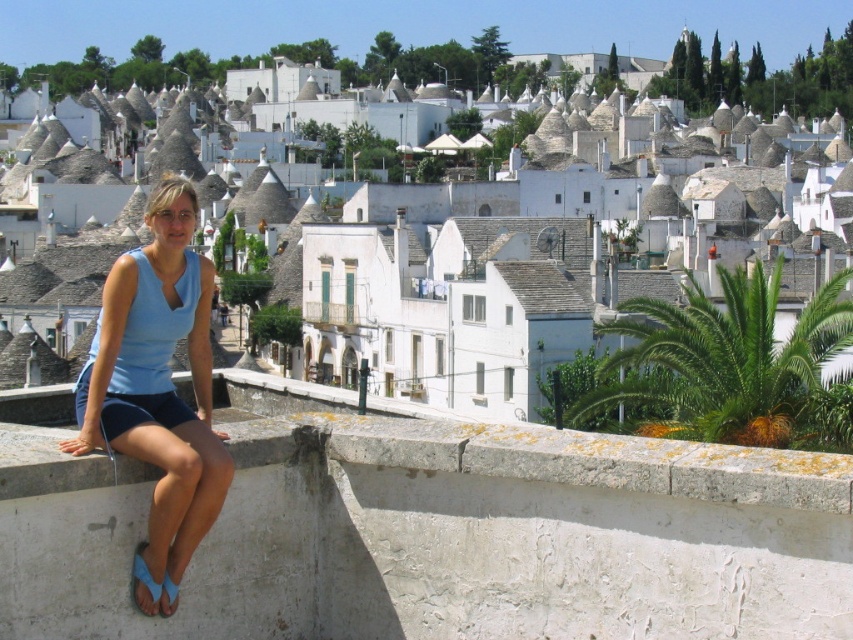
You are a tourist standing in the town square and see the white stone buildings at center and the blue fabric shorts at lower left. Which object is closer to you?

The white stone buildings at center are closer to you because the blue fabric shorts at lower left is behind them.

You are standing at the point labeled point [305,257] and want to take a photo of the trulli buildings in the background. Considering your current position, will you be able to capture the entire trulli buildings in your camera frame without moving? Explain your reasoning based on the distance between you and the viewer.

The point labeled point [305,257] is 395.81 feet away from the viewer. Since the trulli buildings are part of the background scene, their distance from the viewer would be greater than the distance to the point. Therefore, capturing the entire trulli buildings in the camera frame without moving might be challenging due to the significant distance involved.